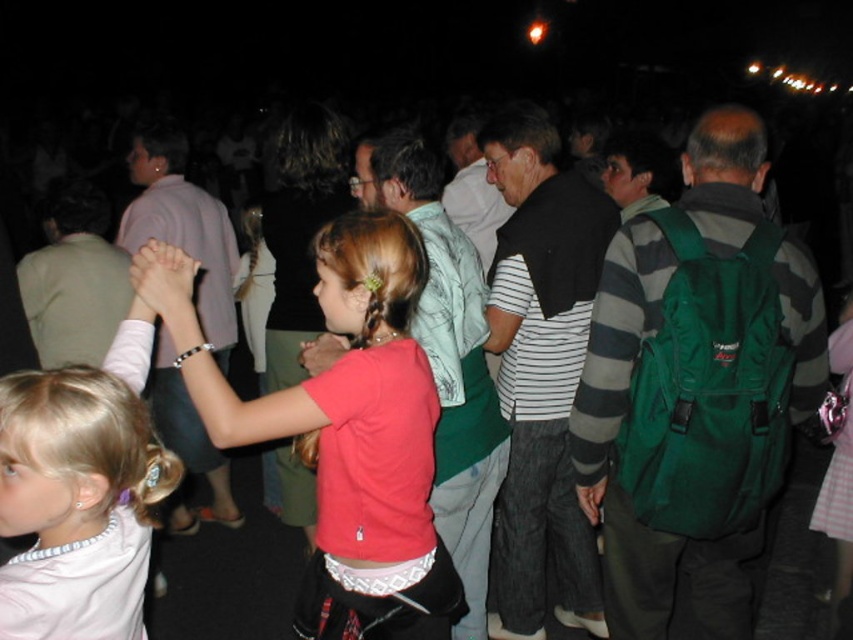
You are a photographer at the event and want to ensure both girls are visible in your photo. Since the two girls are holding hands and both have pink tops, how can you distinguish the matte pink shirt at center from the light pink fabric shirt at center in the photo?

The matte pink shirt at center is larger in size than the light pink fabric shirt at center, so the larger pink top belongs to the girl with blonde curly hair, while the smaller one is worn by the girl in braids.

Based on the coordinates provided, which object is located at point (345, 429) in the image?

The point (345, 429) corresponds to the matte pink shirt at center.